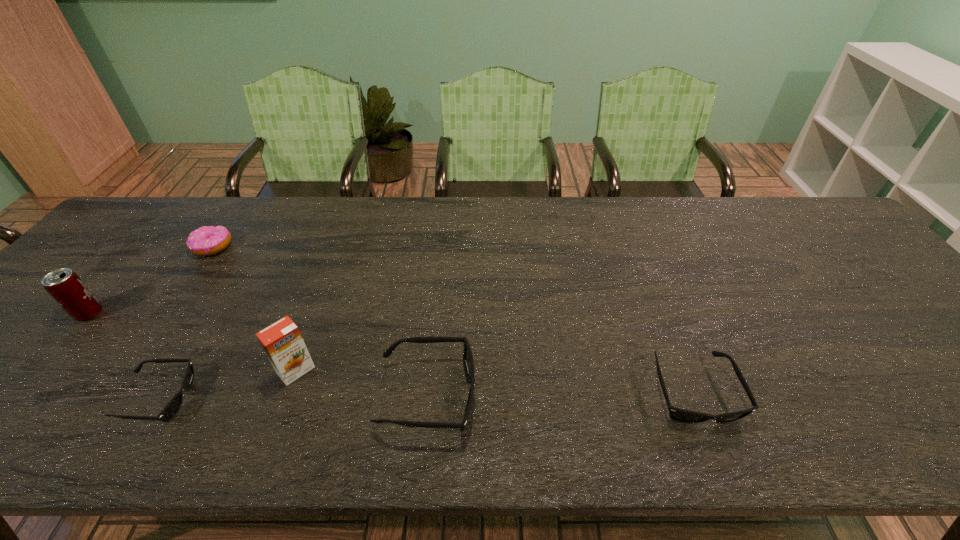
Identify the location of free space located 0.270m on the front-facing side of the tallest sunglasses. Image resolution: width=960 pixels, height=540 pixels. pyautogui.click(x=603, y=395).

Locate an element on the screen. The height and width of the screenshot is (540, 960). vacant space located on the left of the leftmost object is located at coordinates (44, 313).

Identify the location of vacant space located 0.110m on the left of the doughnut. (155, 247).

Image resolution: width=960 pixels, height=540 pixels. I want to click on blank space located on the right of the third object from right to left, so click(372, 370).

The image size is (960, 540). I want to click on object situated at the far edge, so click(205, 241).

At what (x,y) coordinates should I click in order to perform the action: click on orange juice at the near edge. Please return your answer as a coordinate pair (x, y). Looking at the image, I should click on (282, 342).

Image resolution: width=960 pixels, height=540 pixels. What are the coordinates of `object at the left edge` in the screenshot? It's located at (65, 286).

This screenshot has height=540, width=960. In order to click on vacant space at the far edge of the desktop in this screenshot , I will do `click(382, 212)`.

In the image, there is a desktop. Where is `free space at the near edge`? This screenshot has width=960, height=540. free space at the near edge is located at coordinates (739, 393).

Locate an element on the screen. vacant space at the right edge of the desktop is located at coordinates click(841, 261).